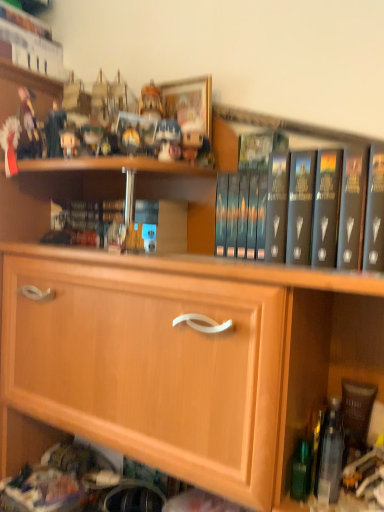
Question: Is clear plastic bottle at lower right with matte plastic toy at upper center, positioned as the 1th toy in front-to-back order?

Choices:
 (A) yes
 (B) no

Answer: (B)

Question: From a real-world perspective, is clear plastic bottle at lower right over matte plastic toy at upper center, which appears as the first toy when viewed from the right?

Choices:
 (A) no
 (B) yes

Answer: (A)

Question: Is matte plastic toy at upper center, which appears as the first toy when viewed from the right, a part of clear plastic bottle at lower right?

Choices:
 (A) no
 (B) yes

Answer: (A)

Question: Does clear plastic bottle at lower right appear on the right side of matte plastic toy at upper center, which appears as the first toy when viewed from the right?

Choices:
 (A) no
 (B) yes

Answer: (B)

Question: From a real-world perspective, is clear plastic bottle at lower right located beneath matte plastic toy at upper center, which appears as the first toy when viewed from the right?

Choices:
 (A) no
 (B) yes

Answer: (B)

Question: Considering the positions of hardcover book at center, placed as the 2th book when sorted from left to right, and dark gray hardcover book at center, the second book when ordered from bottom to top, in the image, is hardcover book at center, placed as the 2th book when sorted from left to right, wider or thinner than dark gray hardcover book at center, the second book when ordered from bottom to top,?

Choices:
 (A) thin
 (B) wide

Answer: (B)

Question: From a real-world perspective, is hardcover book at center, arranged as the second book when viewed from the right, positioned above or below dark gray hardcover book at center, which ranks as the first book in right-to-left order?

Choices:
 (A) above
 (B) below

Answer: (B)

Question: Visually, is hardcover book at center, which ranks as the first book in bottom-to-top order, positioned to the left or to the right of dark gray hardcover book at center, the 3th book in the left-to-right sequence?

Choices:
 (A) left
 (B) right

Answer: (A)

Question: Considering the positions of hardcover book at center, the 2th book viewed from the front, and dark gray hardcover book at center, which ranks as the first book in right-to-left order, in the image, is hardcover book at center, the 2th book viewed from the front, bigger or smaller than dark gray hardcover book at center, which ranks as the first book in right-to-left order,?

Choices:
 (A) small
 (B) big

Answer: (A)

Question: Is clear plastic bottle at lower right bigger or smaller than dark gray hardcover book at center, which ranks as the first book in right-to-left order?

Choices:
 (A) big
 (B) small

Answer: (B)

Question: Based on their positions, is clear plastic bottle at lower right located to the left or right of dark gray hardcover book at center, the 3th book in the left-to-right sequence?

Choices:
 (A) left
 (B) right

Answer: (B)

Question: In terms of height, does clear plastic bottle at lower right look taller or shorter compared to dark gray hardcover book at center, marked as the third book in a back-to-front arrangement?

Choices:
 (A) short
 (B) tall

Answer: (A)

Question: Is clear plastic bottle at lower right wider or thinner than dark gray hardcover book at center, marked as the third book in a back-to-front arrangement?

Choices:
 (A) thin
 (B) wide

Answer: (A)

Question: Do you think hardcover book at center, arranged as the second book when viewed from the right, is within wooden cabinet at center, or outside of it?

Choices:
 (A) outside
 (B) inside

Answer: (B)

Question: Considering their positions, is hardcover book at center, the third book from the top, located in front of or behind wooden cabinet at center?

Choices:
 (A) front
 (B) behind

Answer: (B)